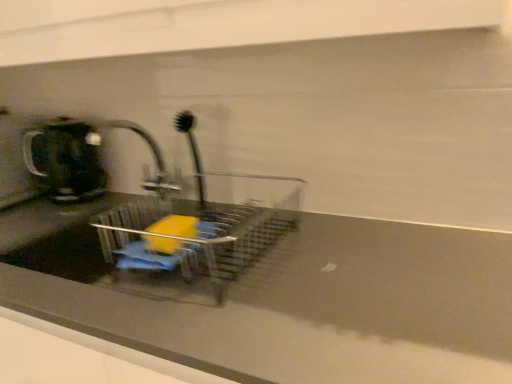
Image resolution: width=512 pixels, height=384 pixels. Identify the location of vacant region under clear plastic sink at center (from a real-world perspective). (243, 259).